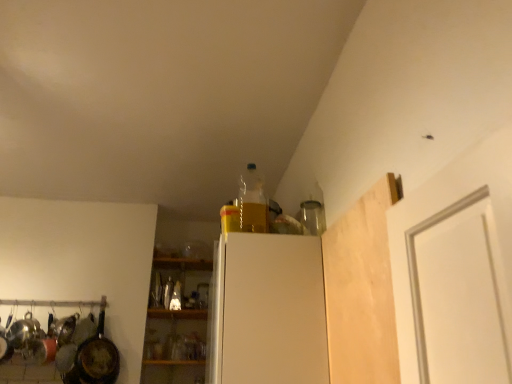
Question: Does rusty metal frying pan at left have a lesser height compared to light wood/rough plank at upper right?

Choices:
 (A) no
 (B) yes

Answer: (B)

Question: Can you confirm if rusty metal frying pan at left is smaller than light wood/rough plank at upper right?

Choices:
 (A) yes
 (B) no

Answer: (B)

Question: Is rusty metal frying pan at left positioned with its back to light wood/rough plank at upper right?

Choices:
 (A) no
 (B) yes

Answer: (A)

Question: Are rusty metal frying pan at left and light wood/rough plank at upper right beside each other?

Choices:
 (A) no
 (B) yes

Answer: (A)

Question: From a real-world perspective, is rusty metal frying pan at left physically above light wood/rough plank at upper right?

Choices:
 (A) yes
 (B) no

Answer: (B)

Question: Considering the relative sizes of rusty metal frying pan at left and light wood/rough plank at upper right in the image provided, is rusty metal frying pan at left thinner than light wood/rough plank at upper right?

Choices:
 (A) yes
 (B) no

Answer: (B)

Question: Considering the relative sizes of translucent glass bottle at center, which is the second bottle from front to back, and light wood/rough plank at upper right in the image provided, is translucent glass bottle at center, which is the second bottle from front to back, thinner than light wood/rough plank at upper right?

Choices:
 (A) no
 (B) yes

Answer: (A)

Question: Is light wood/rough plank at upper right at the back of translucent glass bottle at center, which is the second bottle from front to back?

Choices:
 (A) no
 (B) yes

Answer: (A)

Question: Is translucent glass bottle at center, which is the third bottle in right-to-left order, further to the viewer compared to light wood/rough plank at upper right?

Choices:
 (A) yes
 (B) no

Answer: (A)

Question: Is light wood/rough plank at upper right surrounded by translucent glass bottle at center, which is the third bottle in right-to-left order?

Choices:
 (A) yes
 (B) no

Answer: (B)

Question: Can you confirm if translucent glass bottle at center, which ranks as the 1th bottle in left-to-right order, is positioned to the right of light wood/rough plank at upper right?

Choices:
 (A) yes
 (B) no

Answer: (B)

Question: From the image's perspective, is translucent glass bottle at center, which ranks as the 2th bottle in back-to-front order, on top of light wood/rough plank at upper right?

Choices:
 (A) no
 (B) yes

Answer: (A)

Question: From the image's perspective, is translucent glass bottle at center, which is the third bottle in right-to-left order, above translucent plastic bottle at upper center, placed as the third bottle when sorted from bottom to top?

Choices:
 (A) yes
 (B) no

Answer: (B)